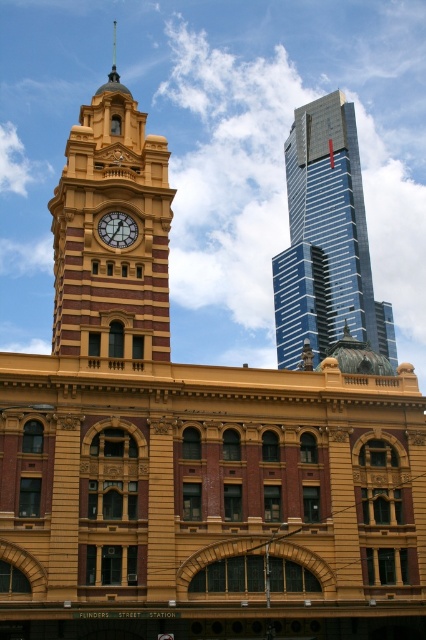
Which is behind, point (351, 296) or point (103, 236)?

The point (351, 296) is more distant.

Which of these two, shiny glass skyscraper at upper right or matte gold clock at center, stands taller?

shiny glass skyscraper at upper right

Based on the photo, measure the distance between shiny glass skyscraper at upper right and camera.

shiny glass skyscraper at upper right and camera are 386.58 feet apart from each other.

Image resolution: width=426 pixels, height=640 pixels. In order to click on shiny glass skyscraper at upper right in this screenshot , I will do `click(325, 241)`.

Is matte yellow clock tower at center shorter than matte gold clock at center?

No, matte yellow clock tower at center is not shorter than matte gold clock at center.

Does matte yellow clock tower at center have a smaller size compared to matte gold clock at center?

Incorrect, matte yellow clock tower at center is not smaller in size than matte gold clock at center.

In order to click on matte yellow clock tower at center in this screenshot , I will do `click(103, 241)`.

Between matte yellow clock tower at center and shiny glass skyscraper at upper right, which one is positioned higher?

matte yellow clock tower at center is above.

Can you confirm if matte yellow clock tower at center is taller than shiny glass skyscraper at upper right?

Yes.

You are a GUI agent. You are given a task and a screenshot of the screen. Output one action in this format:
    pyautogui.click(x=<x>, y=<y>)
    Task: Click on the matte yellow clock tower at center
    The image size is (426, 640).
    Given the screenshot: What is the action you would take?
    pyautogui.click(x=103, y=241)